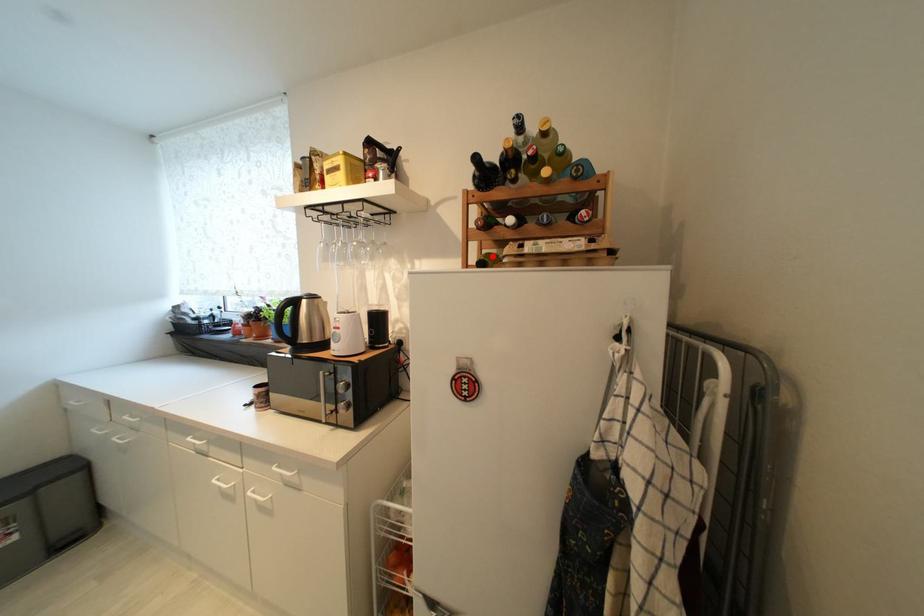
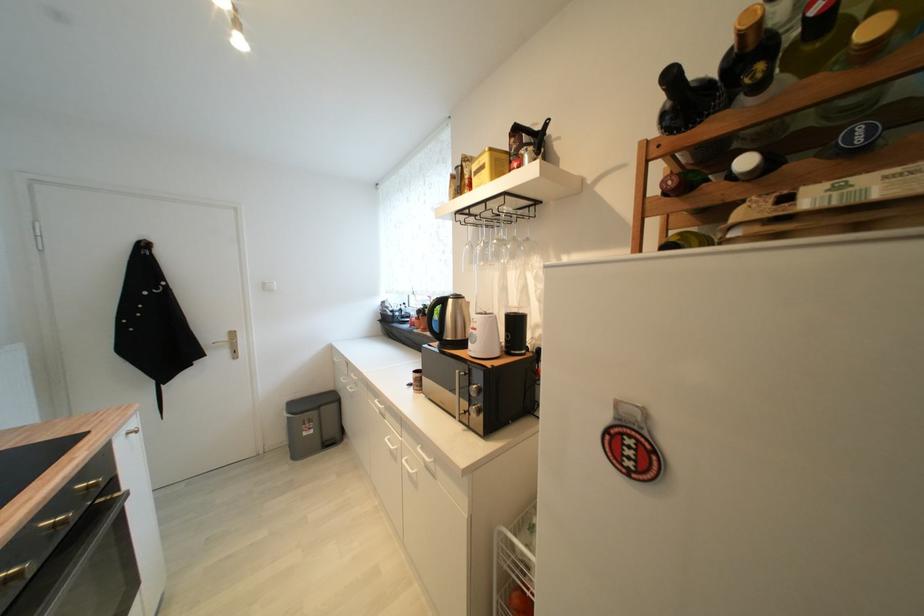
Find the pixel in the second image that matches the highlighted location in the first image.

(687, 236)